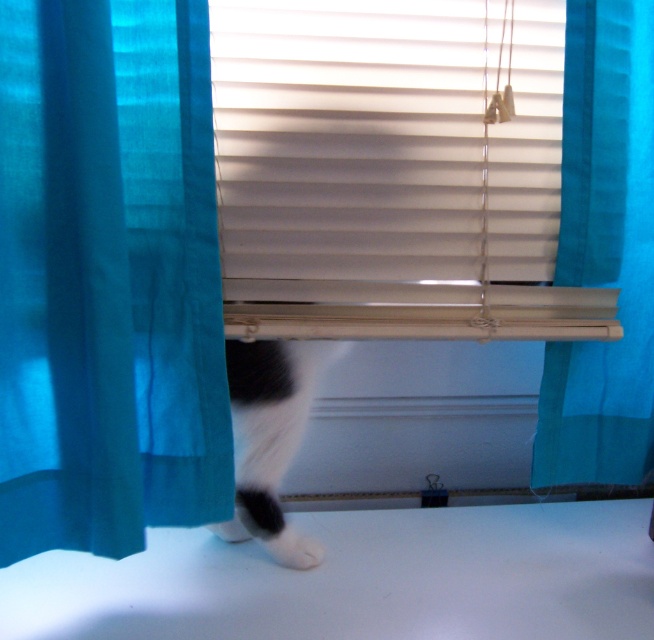
Does point (46, 417) lie behind point (232, 520)?

That is False.

Which is more to the right, teal sheer curtain at left or black and white fur at lower center?

Positioned to the right is black and white fur at lower center.

Find the location of a particular element. teal sheer curtain at left is located at coordinates (107, 276).

Who is positioned more to the left, white plastic blinds at center or teal sheer curtain at right?

white plastic blinds at center

Who is lower down, white plastic blinds at center or teal sheer curtain at right?

teal sheer curtain at right is lower down.

The image size is (654, 640). What do you see at coordinates (381, 145) in the screenshot?
I see `white plastic blinds at center` at bounding box center [381, 145].

Identify the location of white plastic blinds at center. (381, 145).

Who is more forward, (x=364, y=218) or (x=283, y=433)?

Point (x=364, y=218)

In order to click on white plastic blinds at center in this screenshot , I will do `click(381, 145)`.